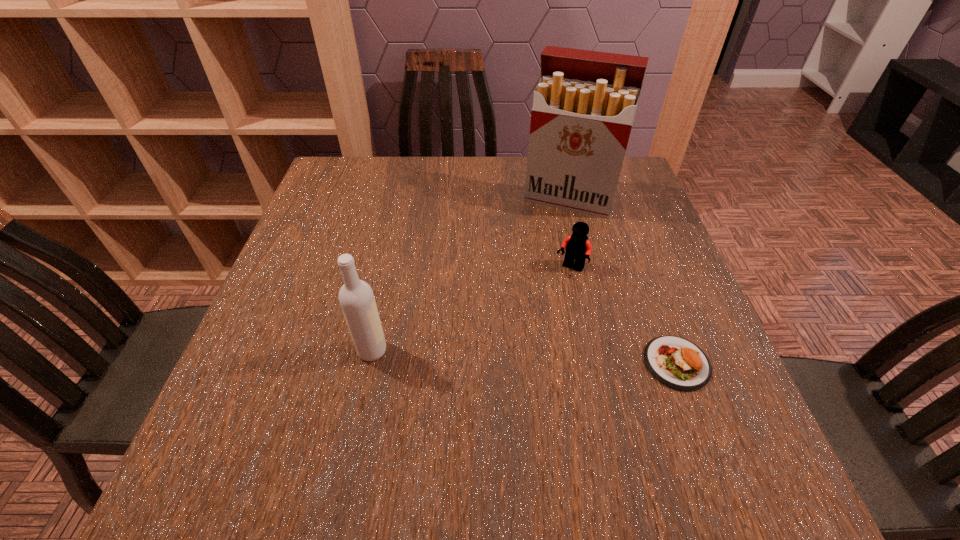
At what (x,y) coordinates should I click in order to perform the action: click on free point located 0.080m on the front-facing side of the third tallest object. Please return your answer as a coordinate pair (x, y). Image resolution: width=960 pixels, height=540 pixels. Looking at the image, I should click on (x=549, y=300).

Locate an element on the screen. This screenshot has width=960, height=540. vacant area located 0.340m on the front-facing side of the third tallest object is located at coordinates (488, 395).

Find the location of `vacant space located 0.050m with the lid open on the tallest object`. vacant space located 0.050m with the lid open on the tallest object is located at coordinates (553, 229).

This screenshot has width=960, height=540. I want to click on free region located with the lid open on the tallest object, so click(x=536, y=274).

The image size is (960, 540). Find the location of `free location located 0.120m with the lid open on the tallest object`. free location located 0.120m with the lid open on the tallest object is located at coordinates point(546,246).

At what (x,y) coordinates should I click in order to perform the action: click on object situated at the far edge. Please return your answer as a coordinate pair (x, y). This screenshot has width=960, height=540. Looking at the image, I should click on (584, 105).

Locate an element on the screen. The width and height of the screenshot is (960, 540). object that is at the near edge is located at coordinates (678, 363).

At what (x,y) coordinates should I click in order to perform the action: click on patty (food) situated at the right edge. Please return your answer as a coordinate pair (x, y). This screenshot has width=960, height=540. Looking at the image, I should click on (678, 363).

Find the location of `cigarette case situated at the right edge`. cigarette case situated at the right edge is located at coordinates (584, 105).

The height and width of the screenshot is (540, 960). Find the location of `object that is at the far right corner`. object that is at the far right corner is located at coordinates pos(584,105).